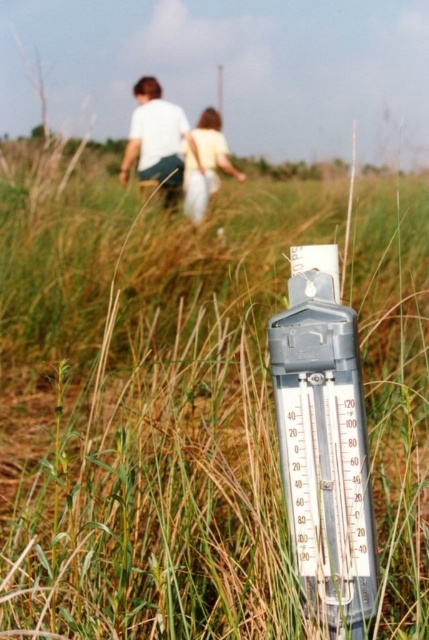
In the scene shown: You are standing at the thermometer mounted on a pole in the grassy field. You notice two points in the distance labeled as point (165, 160) and point (196, 166). Which point is closer to your current position?

Point (196, 166) is closer to your current position because it is in front of point (165, 160).

You are standing at the base of the thermometer pole and want to greet the two people walking away. If you start walking towards them at a speed of 1.5 meters per second, how many seconds will it take you to reach the person in the white cotton shirt at upper center?

The two people are 7.09 meters apart. However, the exact distance from your starting point to the white cotton shirt at upper center isn

You are standing near the thermometer in the grassy field and want to take a photo of both the white cotton shirt at upper center and the light yellow fabric dress at center in the same frame. Based on their positions, will they both fit in your camera viewfinder if the maximum width it can capture is 12 inches?

The white cotton shirt at upper center and light yellow fabric dress at center are 11.94 inches apart. Since the distance between them is less than 12 inches, they will both fit within the camera viewfinder.